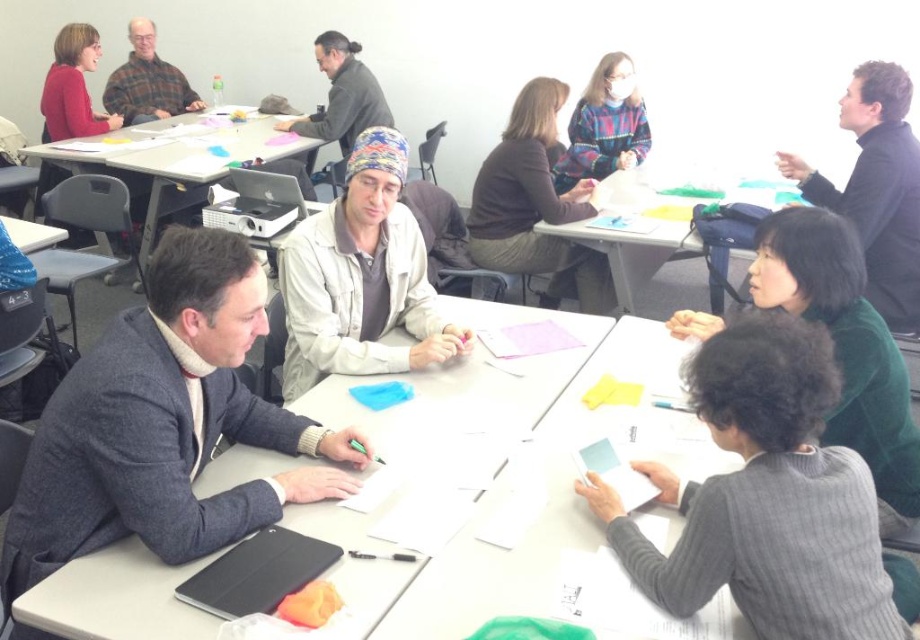
Question: Which object is positioned closest to the dark brown sweater at upper center?

Choices:
 (A) knitted wool hat at center
 (B) dark green sweater at lower right
 (C) matte red sweater at upper left
 (D) matte plastic table at center

Answer: (D)

Question: Does dark brown sweater at upper center have a smaller size compared to plaid flannel shirt at upper left?

Choices:
 (A) yes
 (B) no

Answer: (B)

Question: Can you confirm if black matte jacket at upper right is smaller than dark gray sweater at center?

Choices:
 (A) yes
 (B) no

Answer: (A)

Question: Which of these objects is positioned farthest from the dark green sweater at lower right?

Choices:
 (A) white paper at center
 (B) dark gray suit at center
 (C) white plastic table at center
 (D) plaid flannel shirt at upper left

Answer: (D)

Question: Does gray ribbed sweater at lower right appear on the left side of black matte jacket at upper right?

Choices:
 (A) yes
 (B) no

Answer: (A)

Question: Which object is farther from the camera taking this photo?

Choices:
 (A) gray ribbed sweater at lower right
 (B) plaid flannel shirt at upper left

Answer: (B)